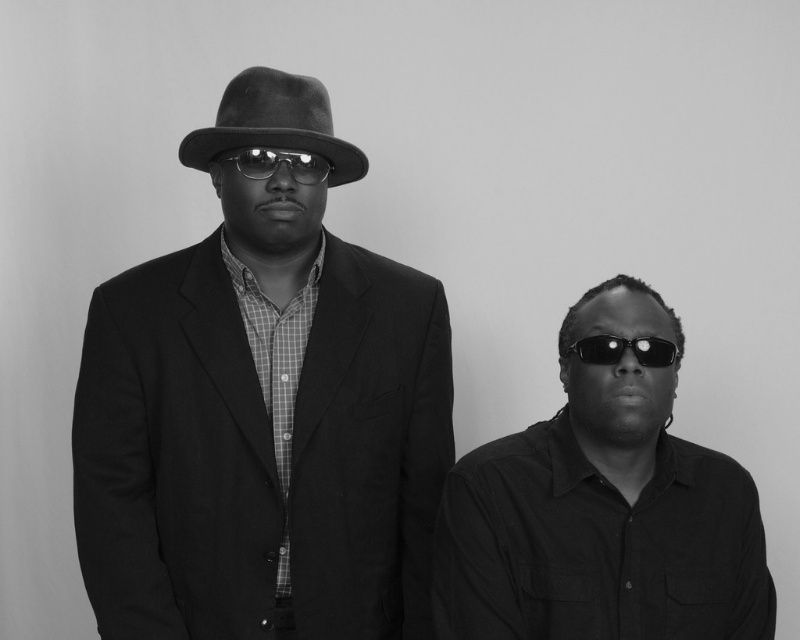
You are a photographer setting up for a portrait shoot. You need to position the black reflective sunglasses at right and the matte black goggles at center so that they are exactly 50 centimeters apart. Based on the current setup shown in the image, do you need to move the objects closer together or farther apart to achieve the desired distance?

The black reflective sunglasses at right is currently 46.95 centimeters away from the matte black goggles at center. To reach the desired 50 centimeters, you need to move the objects farther apart by approximately 3.05 centimeters.

You are a photographer setting up a studio with limited space. You have two items to place on a shelf that can only accommodate one of them. The items are the black reflective sunglasses at right and the matte black goggles at center. Which item should you choose to fit on the shelf based on their sizes?

The matte black goggles at center should be chosen because the black reflective sunglasses at right are larger in size and would not fit on the shelf.

You are a photographer standing 1.5 meters away from the camera. You want to adjust the matte black hat at center so that it is closer to the camera. How much distance do you need to move it towards the camera?

The matte black hat at center is currently 1.36 meters away from the camera. To bring it closer to the camera by 0.14 meters, you need to move it 0.14 meters forward so that the new distance becomes 1.36m minus 0.14m equals 1.22 meters. This adjustment will place the hat closer to the camera as desired.